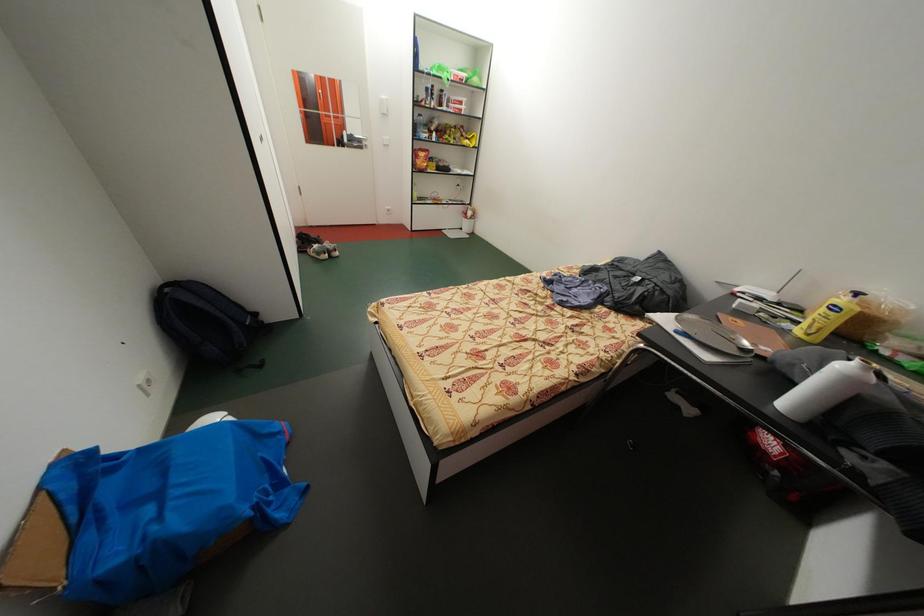
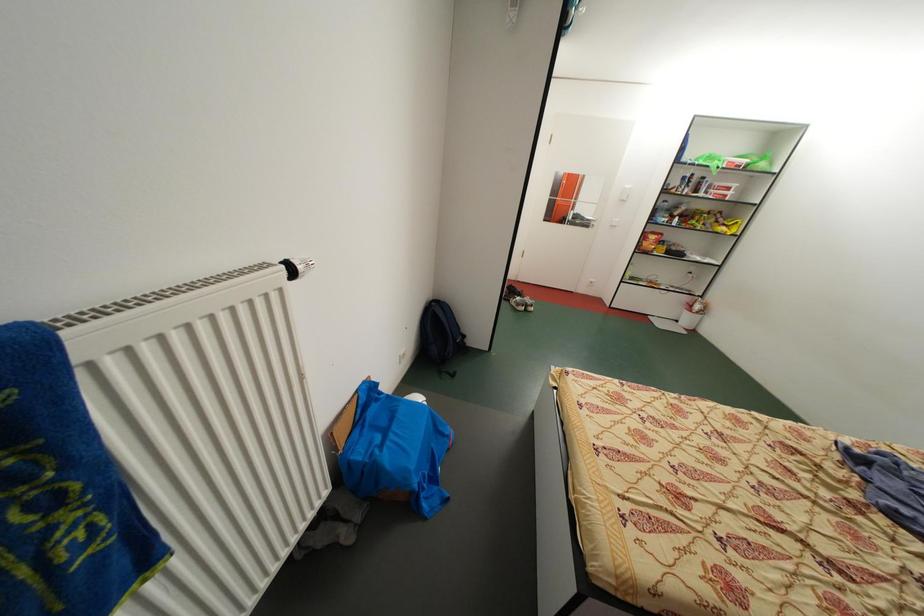
Question: The images are taken continuously from a first-person perspective. In which direction is your viewpoint rotating?

Choices:
 (A) Left
 (B) Right
 (C) Up
 (D) Down

Answer: (A)